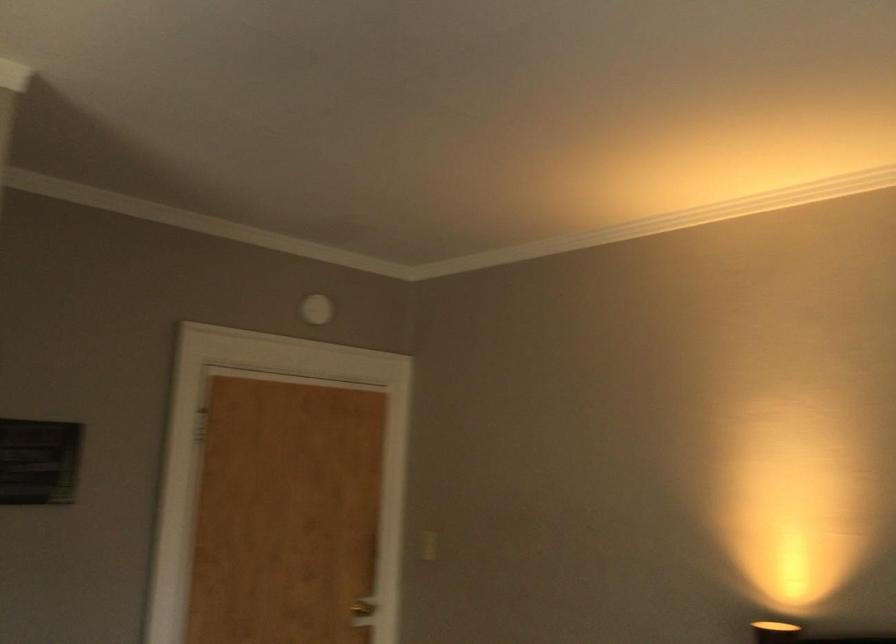
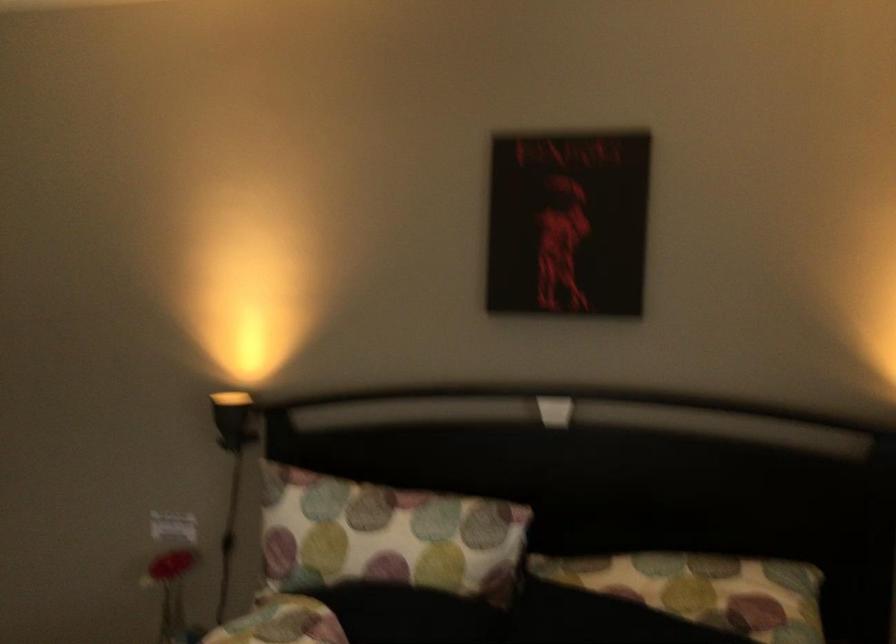
Question: The camera is either moving clockwise (left) or counter-clockwise (right) around the object. The first image is from the beginning of the video and the second image is from the end. Is the camera moving left or right when shooting the video?

Choices:
 (A) Left
 (B) Right

Answer: (A)